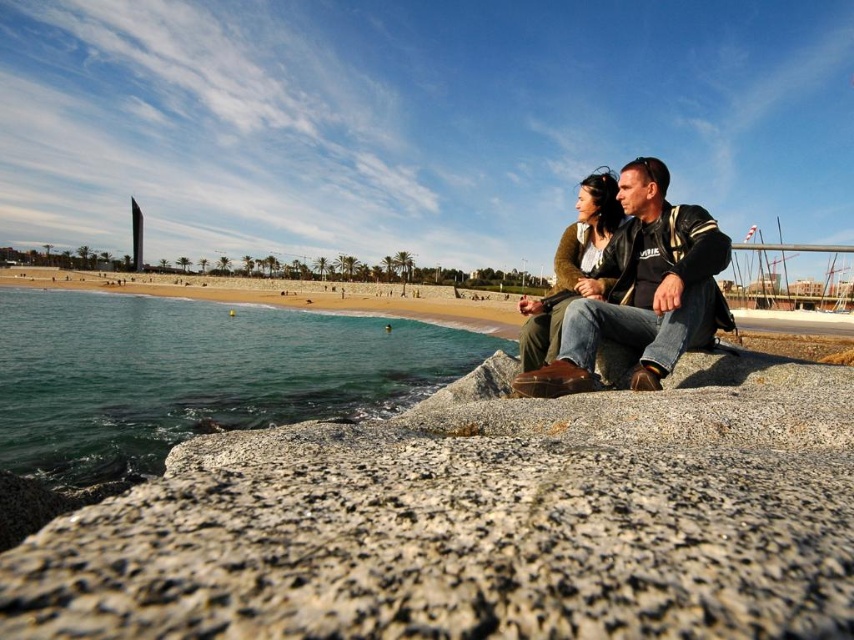
Question: Is leather jacket at center below green fabric jacket at center?

Choices:
 (A) yes
 (B) no

Answer: (A)

Question: Can you confirm if granite rock at center is wider than green fabric jacket at center?

Choices:
 (A) no
 (B) yes

Answer: (B)

Question: Considering the real-world distances, which object is closest to the green fabric jacket at center?

Choices:
 (A) granite rock at center
 (B) smooth sand beach at center
 (C) green water at lower left
 (D) leather jacket at center

Answer: (A)

Question: Which point appears closest to the camera in this image?

Choices:
 (A) (39, 406)
 (B) (640, 209)
 (C) (244, 576)
 (D) (498, 300)

Answer: (C)

Question: Which object appears closest to the camera in this image?

Choices:
 (A) smooth sand beach at center
 (B) green water at lower left

Answer: (B)

Question: Does granite rock at center have a smaller size compared to green water at lower left?

Choices:
 (A) no
 (B) yes

Answer: (B)